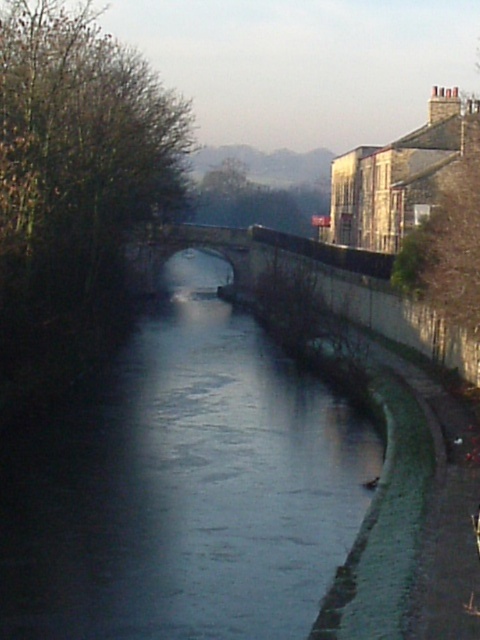
You are standing at the origin point of the coordinate system in the image. You want to reach the smooth concrete river at center. Which direction should you move in to get there?

To reach the smooth concrete river at center, you should move towards the point at coordinate 0.767 on the x axis and 0.381 on the y axis.

You are a pedestrian wanting to cross the river. You see the smooth concrete river at center and the stone arch bridge at center. Which object should you use to cross the river?

You should use the stone arch bridge at center to cross the river because bridges are designed for crossing water bodies, while the smooth concrete river at center is the actual river itself and cannot be walked on.

From the picture: You are a pedestrian trying to cross the river. You see the smooth concrete river at center and the stone arch bridge at center. Which object should you use to safely cross the river?

You should use the stone arch bridge at center to safely cross the river since it is located above the smooth concrete river at center.